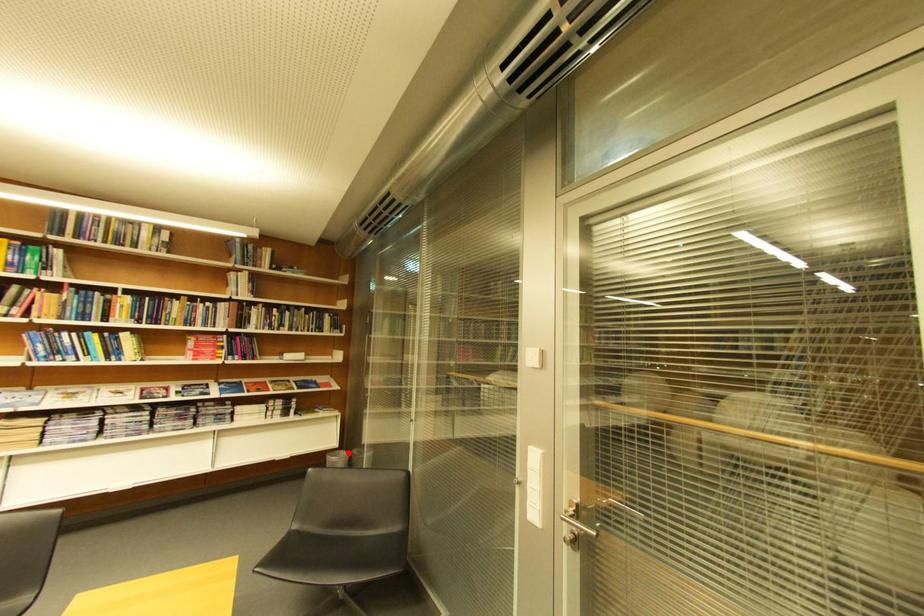
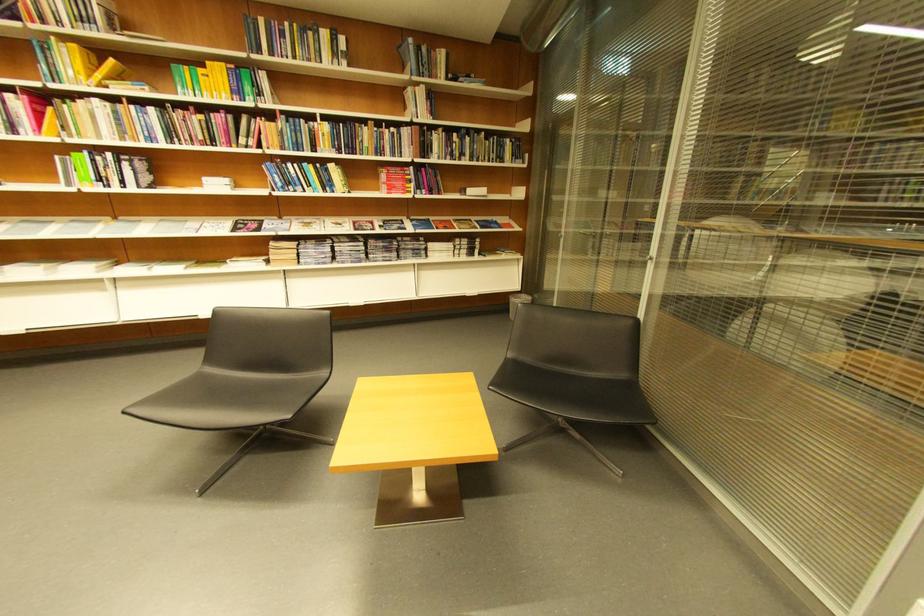
The point at the highlighted location is marked in the first image. Where is the corresponding point in the second image?

(529, 297)